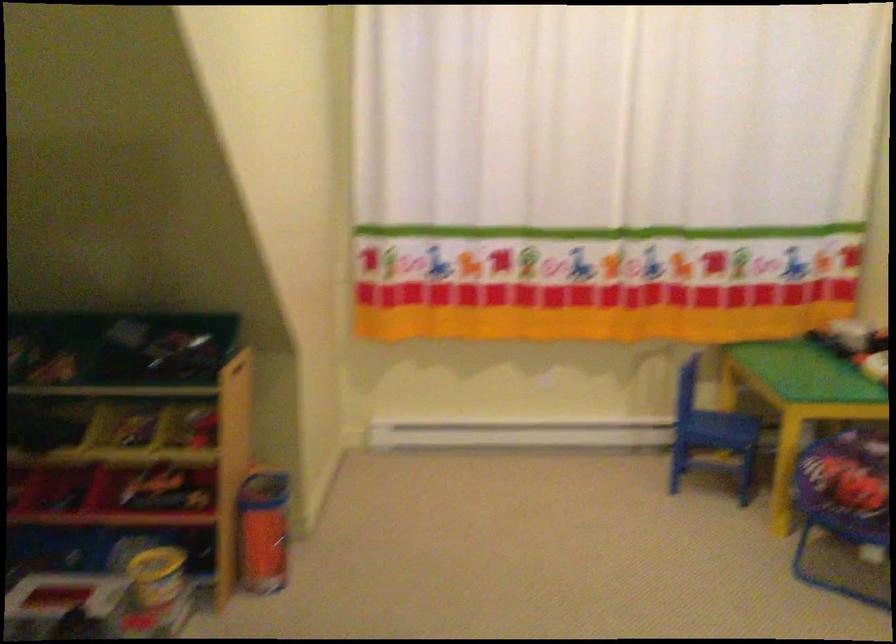
What do you see at coordinates (263, 532) in the screenshot?
I see `the red storage bin` at bounding box center [263, 532].